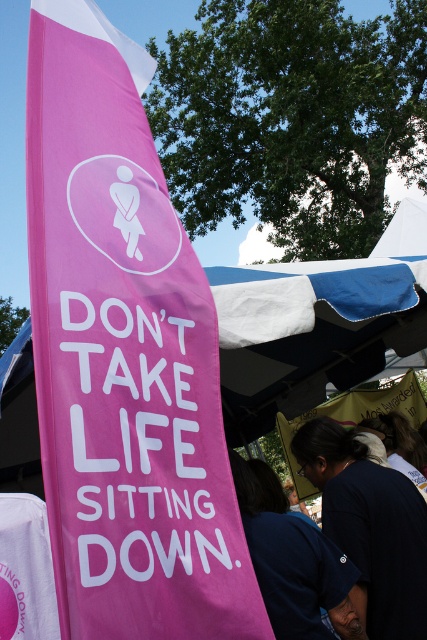
You are setting up a booth at an event and need to place a 1.5 meter wide table between the pink fabric banner at left and the dark blue fabric at lower center. Can the table fit in the space between them?

The distance between the pink fabric banner at left and the dark blue fabric at lower center is 1.25 meters. Since the table is 1.5 meters wide, it cannot fit in the space between them as the required space is wider than the available distance.

You are standing at the center of the image. There is a point marked at coordinates point (123,356). What object is located at that point?

The pink fabric banner at left is located at point (123,356).